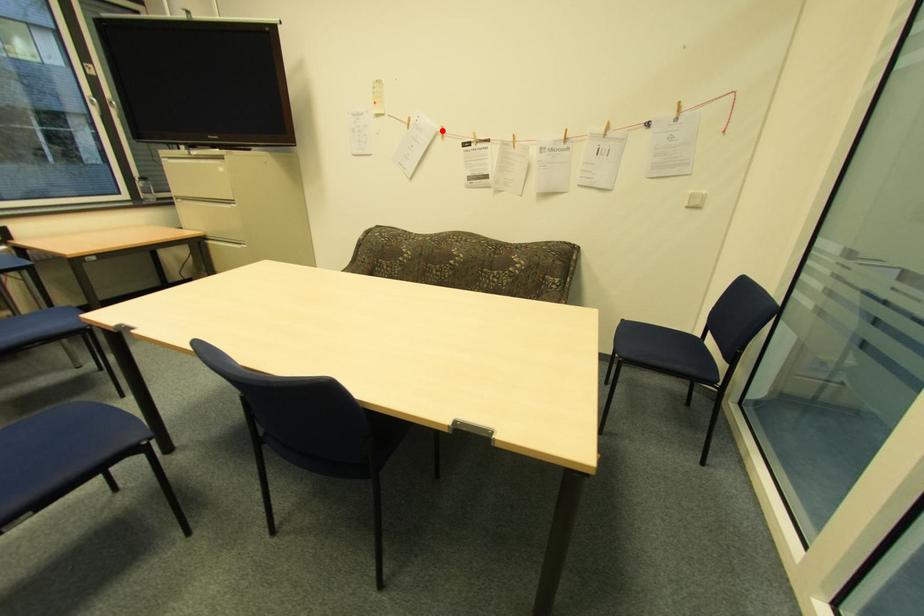
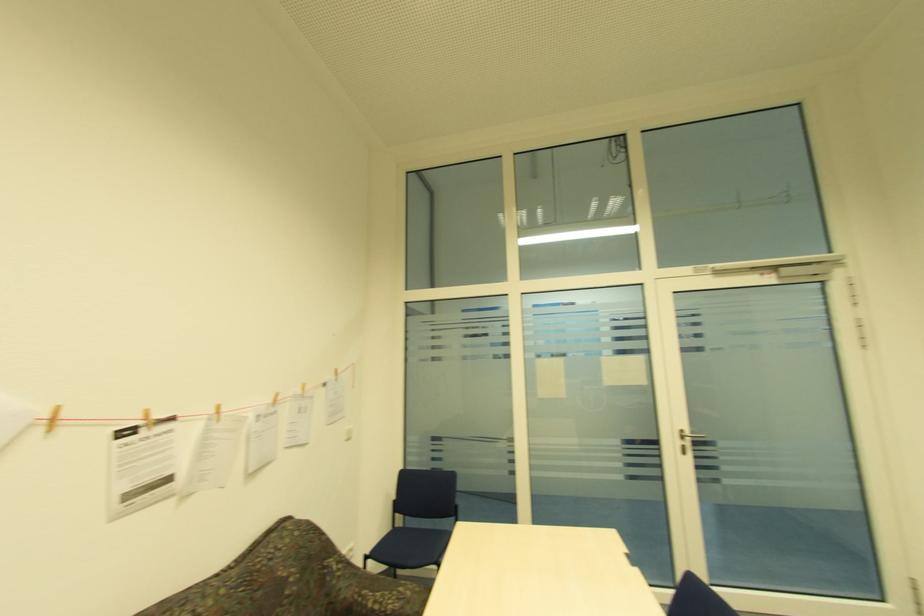
The point at the highlighted location is marked in the first image. Where is the corresponding point in the second image?

(49, 416)